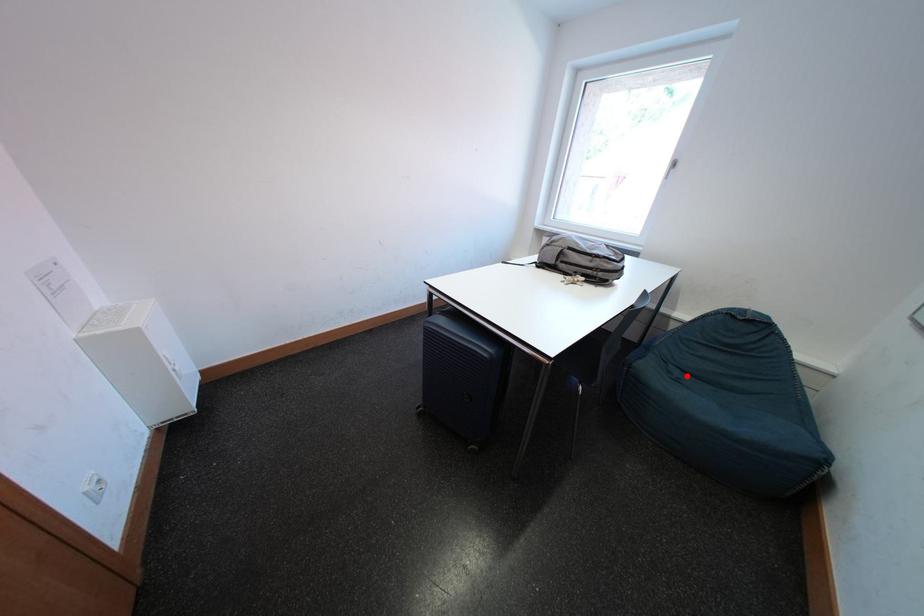
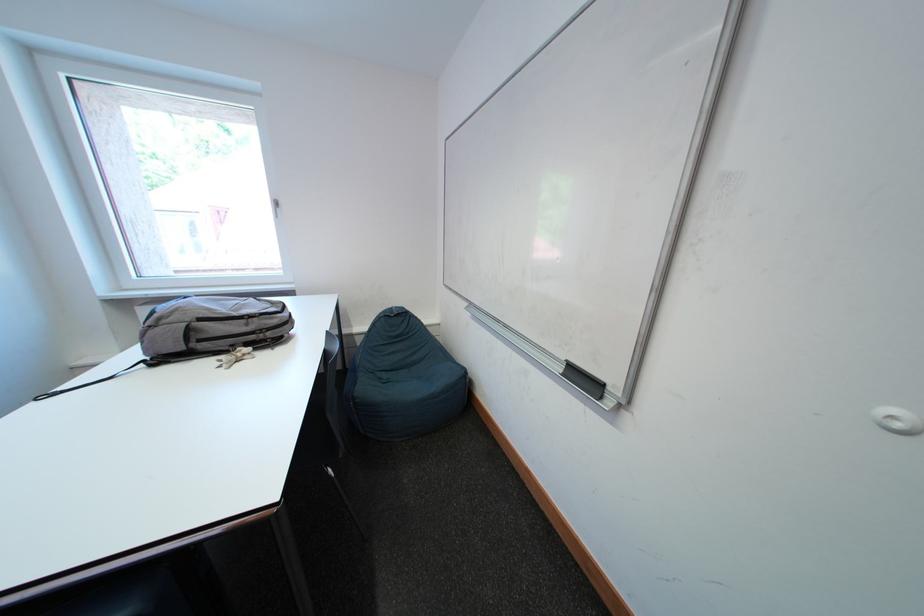
Find the pixel in the second image that matches the highlighted location in the first image.

(394, 379)